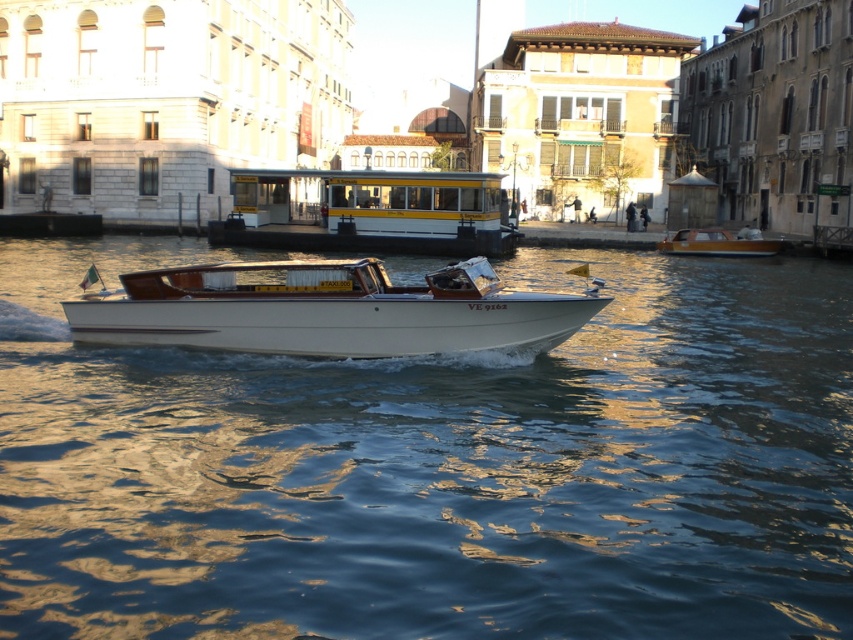
You are standing at the point with coordinates (436, 465) in the canal scene. What do you see directly in front of you?

At point (436, 465) lies glossy water at center.